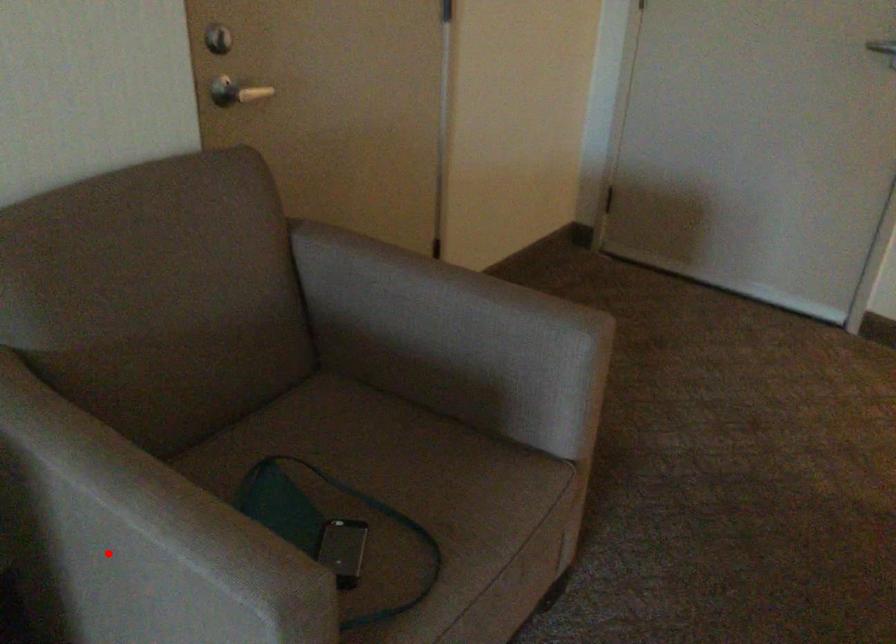
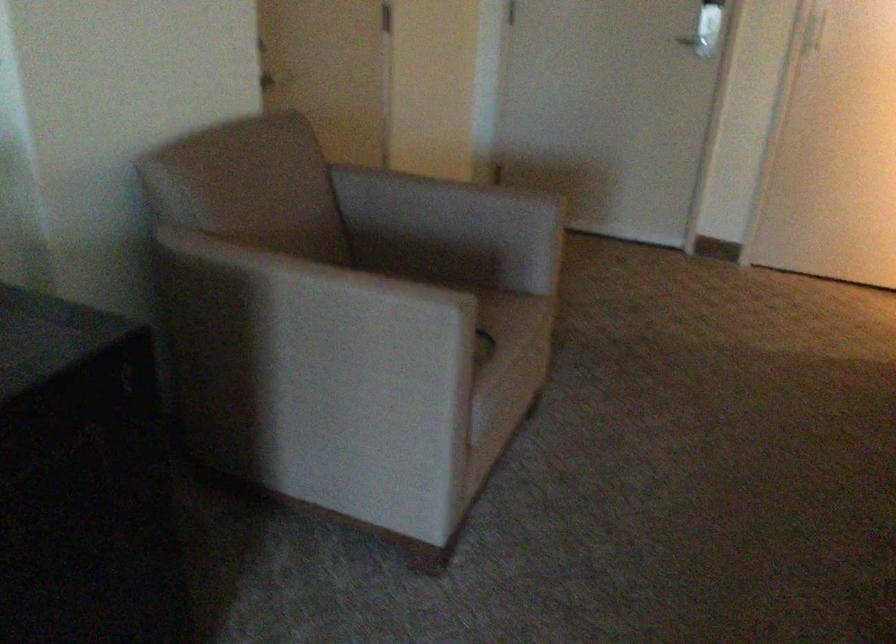
In the second image, find the point that corresponds to the highlighted location in the first image.

(314, 325)